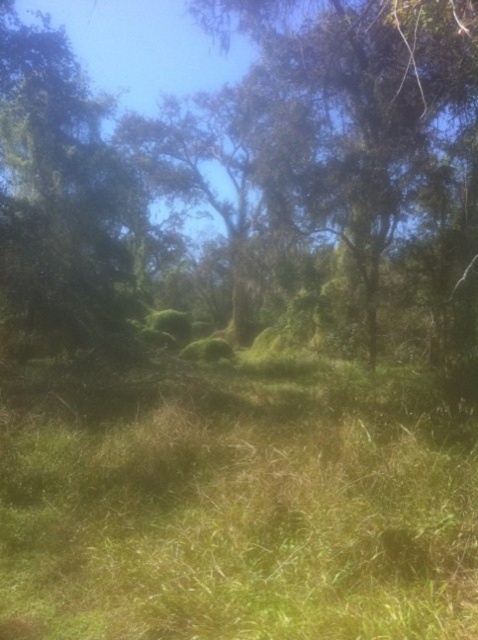
Question: Which point is closer to the camera?

Choices:
 (A) (267, 24)
 (B) (469, 564)

Answer: (B)

Question: Is green grass at center below green mossy tree at center?

Choices:
 (A) no
 (B) yes

Answer: (B)

Question: Is green grass at center smaller than green mossy tree at center?

Choices:
 (A) no
 (B) yes

Answer: (B)

Question: Does green grass at center appear under green mossy tree at center?

Choices:
 (A) yes
 (B) no

Answer: (A)

Question: Which of the following is the closest to the observer?

Choices:
 (A) (365, 3)
 (B) (362, 429)

Answer: (B)